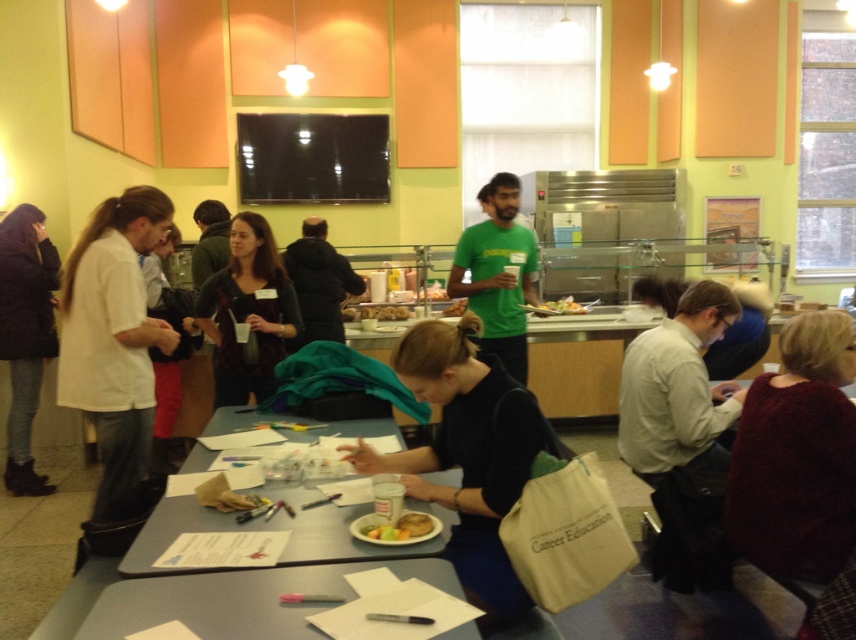
Question: Which point appears farthest from the camera in this image?

Choices:
 (A) (510, 236)
 (B) (375, 538)

Answer: (A)

Question: Is white matte shirt at left to the right of dark brown leather jacket at left from the viewer's perspective?

Choices:
 (A) no
 (B) yes

Answer: (B)

Question: Which of the following is the closest to the observer?

Choices:
 (A) (562, 308)
 (B) (527, 234)
 (C) (34, 289)

Answer: (C)

Question: Considering the relative positions of gray plastic table at lower center and dark brown leather jacket at left in the image provided, where is gray plastic table at lower center located with respect to dark brown leather jacket at left?

Choices:
 (A) above
 (B) below

Answer: (B)

Question: Is matte gray table at center closer to the viewer compared to dark brown sweater at center?

Choices:
 (A) no
 (B) yes

Answer: (B)

Question: Among these points, which one is farthest from the camera?

Choices:
 (A) (230, 516)
 (B) (795, 541)

Answer: (B)